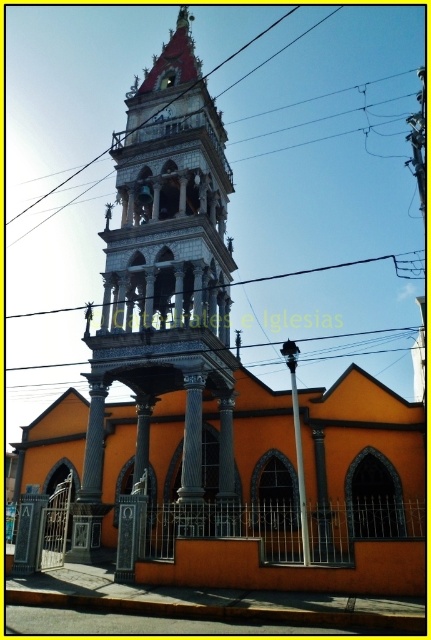
Question: Considering the real-world distances, which object is closest to the polished stone pillar at center?

Choices:
 (A) metallic wire at upper center
 (B) white marble tower at center

Answer: (B)

Question: Does polished stone pillar at center have a smaller size compared to metallic wire at upper center?

Choices:
 (A) yes
 (B) no

Answer: (A)

Question: Among these points, which one is nearest to the camera?

Choices:
 (A) (125, 134)
 (B) (205, 202)
 (C) (24, 524)

Answer: (C)

Question: Among these objects, which one is farthest from the camera?

Choices:
 (A) white marble tower at center
 (B) metallic wire at upper center

Answer: (B)

Question: Considering the relative positions of white marble tower at center and metallic wire at upper center in the image provided, where is white marble tower at center located with respect to metallic wire at upper center?

Choices:
 (A) right
 (B) left

Answer: (B)

Question: Does polished stone pillar at center appear on the left side of metallic wire at upper center?

Choices:
 (A) no
 (B) yes

Answer: (B)